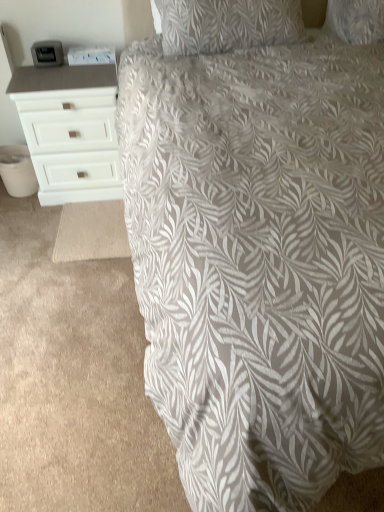
In order to face white matte chest of drawers at left, should I rotate leftwards or rightwards?

Turn left approximately 15.490 degrees to face it.

This screenshot has width=384, height=512. Describe the element at coordinates (70, 130) in the screenshot. I see `white matte chest of drawers at left` at that location.

You are a GUI agent. You are given a task and a screenshot of the screen. Output one action in this format:
    pyautogui.click(x=<x>, y=<y>)
    Task: Click on the white matte chest of drawers at left
    The image size is (384, 512).
    Given the screenshot: What is the action you would take?
    pyautogui.click(x=70, y=130)

Find the location of a particular element. Image resolution: width=384 pixels, height=512 pixels. gray leaf-patterned fabric at center is located at coordinates (257, 248).

The height and width of the screenshot is (512, 384). What do you see at coordinates (257, 248) in the screenshot?
I see `gray leaf-patterned fabric at center` at bounding box center [257, 248].

This screenshot has height=512, width=384. Identify the location of white matte chest of drawers at left. (70, 130).

Is gray leaf-patterned fabric at center to the left or to the right of white matte chest of drawers at left in the image?

In the image, gray leaf-patterned fabric at center appears on the right side of white matte chest of drawers at left.

Based on the photo, is gray leaf-patterned fabric at center behind white matte chest of drawers at left?

No, gray leaf-patterned fabric at center is in front of white matte chest of drawers at left.

Considering the positions of point (159, 329) and point (97, 164), is point (159, 329) closer or farther from the camera than point (97, 164)?

Clearly, point (159, 329) is closer to the camera than point (97, 164).

Based on the photo, from the image's perspective, relative to white matte chest of drawers at left, is gray leaf-patterned fabric at center above or below?

Based on their image positions, gray leaf-patterned fabric at center is located beneath white matte chest of drawers at left.

Consider the image. From a real-world perspective, does gray leaf-patterned fabric at center stand above white matte chest of drawers at left?

No, from a real-world perspective, gray leaf-patterned fabric at center is not over white matte chest of drawers at left

In terms of width, does gray leaf-patterned fabric at center look wider or thinner when compared to white matte chest of drawers at left?

gray leaf-patterned fabric at center is wider than white matte chest of drawers at left.

Who is taller, gray leaf-patterned fabric at center or white matte chest of drawers at left?

With more height is white matte chest of drawers at left.

In terms of size, does gray leaf-patterned fabric at center appear bigger or smaller than white matte chest of drawers at left?

Clearly, gray leaf-patterned fabric at center is larger in size than white matte chest of drawers at left.

Is gray leaf-patterned fabric at center surrounding white matte chest of drawers at left?

No.

Is gray leaf-patterned fabric at center touching white matte chest of drawers at left?

No.

Could you tell me if gray leaf-patterned fabric at center is turned towards white matte chest of drawers at left?

No.

What's the angular difference between gray leaf-patterned fabric at center and white matte chest of drawers at left's facing directions?

The facing directions of gray leaf-patterned fabric at center and white matte chest of drawers at left are 3.6 degrees apart.

This screenshot has width=384, height=512. In the image, there is a white matte chest of drawers at left. Find the location of `bed below it (from a real-world perspective)`. bed below it (from a real-world perspective) is located at coordinates (257, 248).

Can you confirm if white matte chest of drawers at left is positioned to the right of gray leaf-patterned fabric at center?

Incorrect, white matte chest of drawers at left is not on the right side of gray leaf-patterned fabric at center.

In the image, is white matte chest of drawers at left positioned in front of or behind gray leaf-patterned fabric at center?

Clearly, white matte chest of drawers at left is behind gray leaf-patterned fabric at center.

Is point (35, 72) closer to camera compared to point (124, 138)?

No, (35, 72) is behind (124, 138).

From the image's perspective, is white matte chest of drawers at left above gray leaf-patterned fabric at center?

Yes, from the image's perspective, white matte chest of drawers at left is on top of gray leaf-patterned fabric at center.

In the scene shown: From a real-world perspective, who is located lower, white matte chest of drawers at left or gray leaf-patterned fabric at center?

gray leaf-patterned fabric at center is physically lower.

Between white matte chest of drawers at left and gray leaf-patterned fabric at center, which one has larger width?

Wider between the two is gray leaf-patterned fabric at center.

Considering the relative sizes of white matte chest of drawers at left and gray leaf-patterned fabric at center in the image provided, is white matte chest of drawers at left taller than gray leaf-patterned fabric at center?

Yes.

Is white matte chest of drawers at left bigger than gray leaf-patterned fabric at center?

No.

Is white matte chest of drawers at left positioned beyond the bounds of gray leaf-patterned fabric at center?

white matte chest of drawers at left lies outside gray leaf-patterned fabric at center's area.

Is white matte chest of drawers at left beside gray leaf-patterned fabric at center?

No, white matte chest of drawers at left is not making contact with gray leaf-patterned fabric at center.

Could you tell me if white matte chest of drawers at left is facing gray leaf-patterned fabric at center?

Yes, white matte chest of drawers at left faces towards gray leaf-patterned fabric at center.

How many degrees apart are the facing directions of white matte chest of drawers at left and gray leaf-patterned fabric at center?

white matte chest of drawers at left and gray leaf-patterned fabric at center are facing 3.6 degrees away from each other.

At what (x,y) coordinates should I click in order to perform the action: click on the chest of drawers lying behind the gray leaf-patterned fabric at center. Please return your answer as a coordinate pair (x, y). The image size is (384, 512). Looking at the image, I should click on (70, 130).

In the image, there is a white matte chest of drawers at left. Where is `bed below it (from a real-world perspective)`? bed below it (from a real-world perspective) is located at coordinates (257, 248).

Identify the location of the chest of drawers that appears above the gray leaf-patterned fabric at center (from the image's perspective). (70, 130).